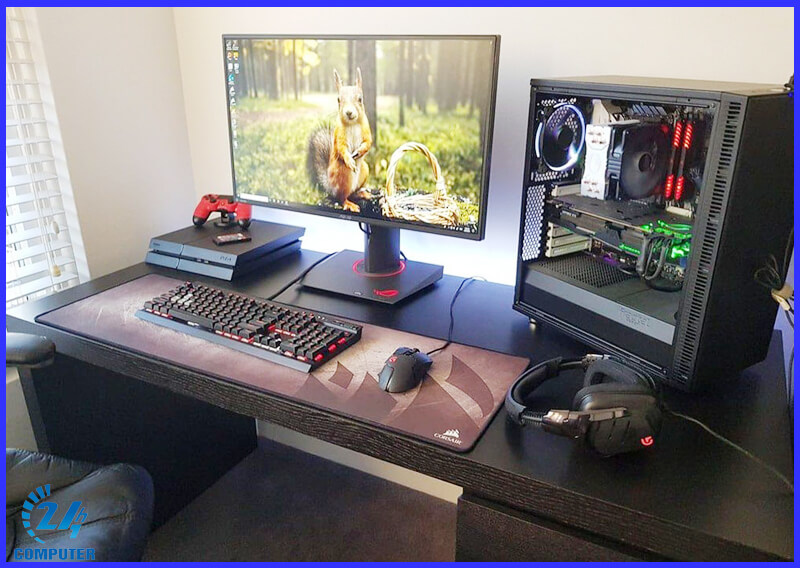
Identify the location of computer monitor. (422, 97).